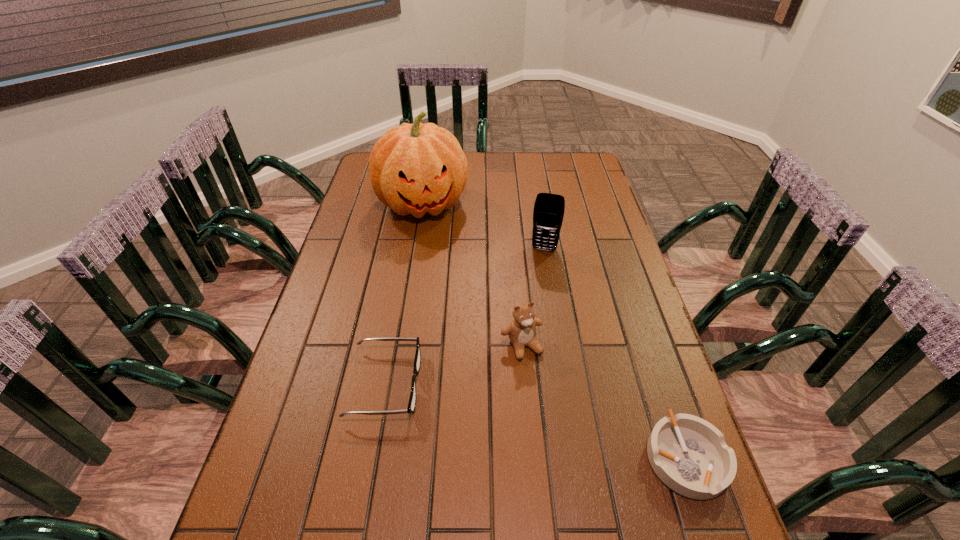
Where is `free space located 0.320m on the carved face of the pumpkin`? free space located 0.320m on the carved face of the pumpkin is located at coordinates (451, 299).

Find the location of a particular element. The image size is (960, 540). blank space located 0.130m on the carved face of the pumpkin is located at coordinates (439, 256).

You are a GUI agent. You are given a task and a screenshot of the screen. Output one action in this format:
    pyautogui.click(x=<x>, y=<y>)
    Task: Click on the free space located on the carved face of the pumpkin
    This screenshot has height=540, width=960.
    Given the screenshot: What is the action you would take?
    pyautogui.click(x=440, y=260)

Where is `vacant space located on the front-facing side of the teddy bear`? vacant space located on the front-facing side of the teddy bear is located at coordinates (563, 424).

Identify the location of vacant position located 0.070m on the front-facing side of the teddy bear. (541, 384).

The width and height of the screenshot is (960, 540). Identify the location of free space located on the front-facing side of the teddy bear. (588, 476).

What are the coordinates of `free location located on the screen of the cellular telephone` in the screenshot? It's located at (522, 343).

Locate an element on the screen. free space located 0.150m on the screen of the cellular telephone is located at coordinates (535, 287).

What are the coordinates of `free space located on the screen of the cellular telephone` in the screenshot? It's located at (523, 337).

Locate an element on the screen. The height and width of the screenshot is (540, 960). object that is positioned at the far edge is located at coordinates (416, 168).